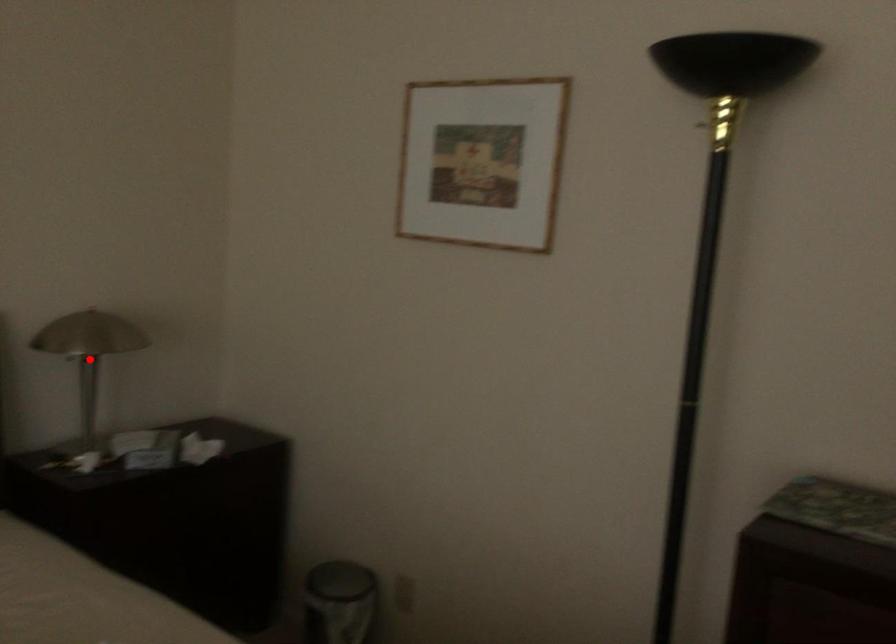
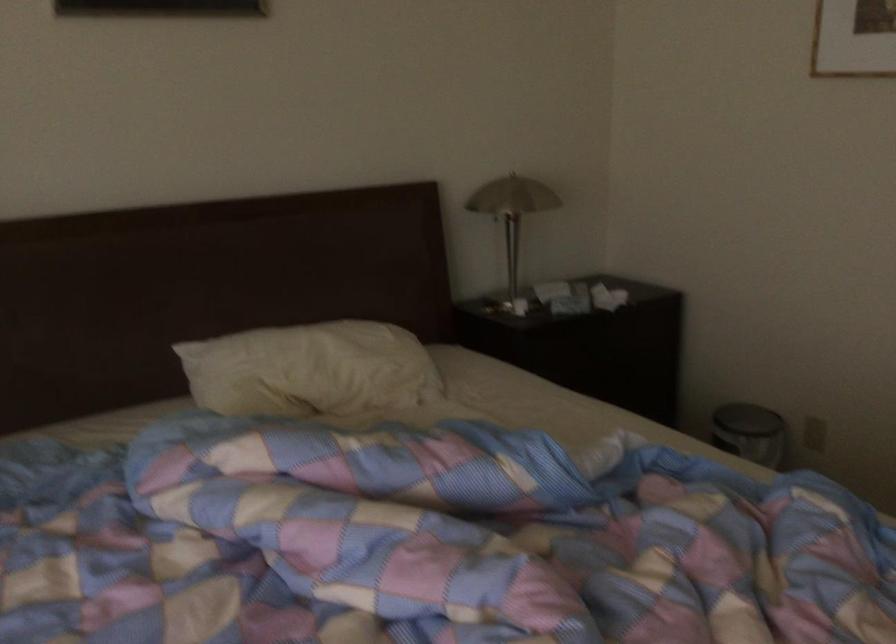
In the second image, find the point that corresponds to the highlighted location in the first image.

(512, 213)